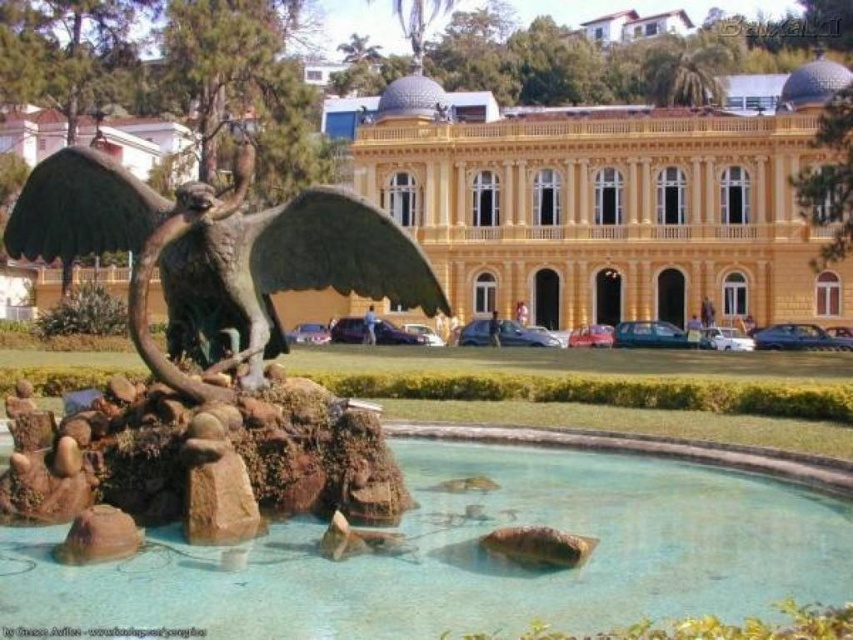
Question: Based on their relative distances, which object is nearer to the yellow matte building at center?

Choices:
 (A) clear glass pond at center
 (B) green matte wing at center
 (C) bronze/golden statue at center

Answer: (A)

Question: From the image, what is the correct spatial relationship of yellow matte building at center in relation to green matte wing at center?

Choices:
 (A) below
 (B) above

Answer: (B)

Question: Can you confirm if yellow matte building at center is positioned below bronze/golden statue at center?

Choices:
 (A) yes
 (B) no

Answer: (B)

Question: Does yellow matte building at center lie behind green matte wing at center?

Choices:
 (A) yes
 (B) no

Answer: (A)

Question: Which point is farther to the camera?

Choices:
 (A) (769, 289)
 (B) (202, 211)

Answer: (A)

Question: Which point is farther to the camera?

Choices:
 (A) clear glass pond at center
 (B) green matte wing at center
 (C) yellow matte building at center
 (D) bronze/golden statue at center

Answer: (C)